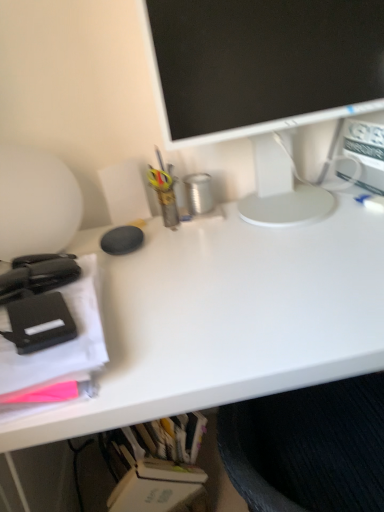
The height and width of the screenshot is (512, 384). I want to click on spots to the right of matte black stapler at left, arranged as the first office supplies when viewed from the front, so click(192, 297).